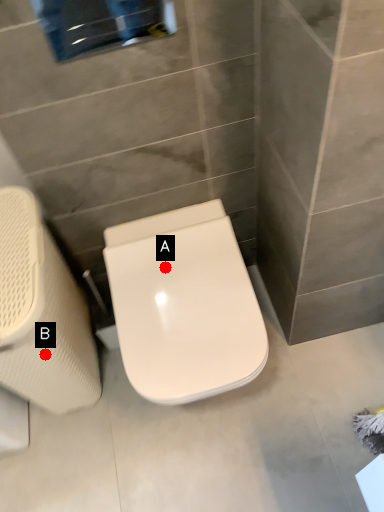
Question: Two points are circled on the image, labeled by A and B beside each circle. Among these points, which one is farthest from the camera?

Choices:
 (A) A is further
 (B) B is further

Answer: (A)